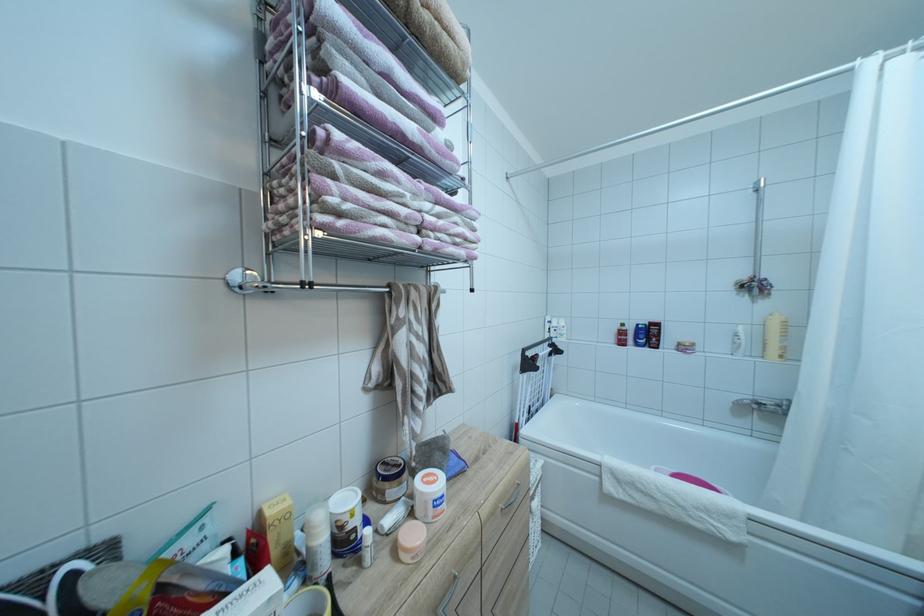
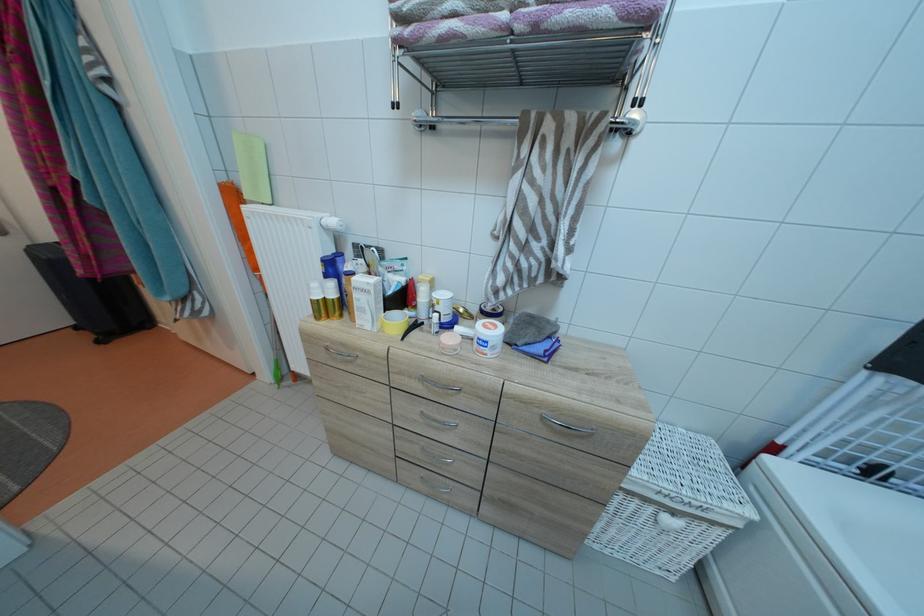
Where in the second image is the point corresponding to pixel 541 511 from the first image?

(675, 525)